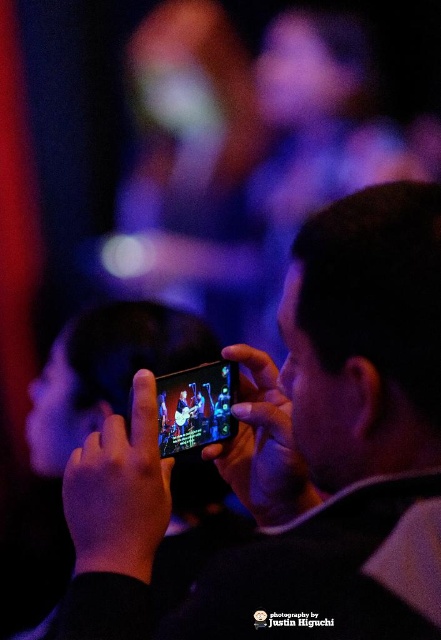
You are at a concert and want to take a photo of the stage. You have two phones available, the black matte phone at center and the black glossy smartphone at center. Which phone should you use if you want to hold it lower to avoid blocking others?

The black glossy smartphone at center should be used because the black matte phone at center is located above it, meaning holding the glossy smartphone lower would keep it out of the way of others.

You are at a concert and want to record the performance. You have two phones in front of you, the black matte phone at center and the black glossy smartphone at center. Which one do you choose if you want the wider device?

The black matte phone at center is wider than the black glossy smartphone at center, so you should choose the black matte phone at center.

You are at a concert and holding a black matte phone at center. You want to take a selfie with the stage lights in the background. Considering the focus distance, will the background remain blurred if you take the photo now?

The black matte phone at center is 17.03 inches away from the viewer. Since the background is already out of focus with a bokeh effect, taking the photo now would keep the background blurred for the selfie.